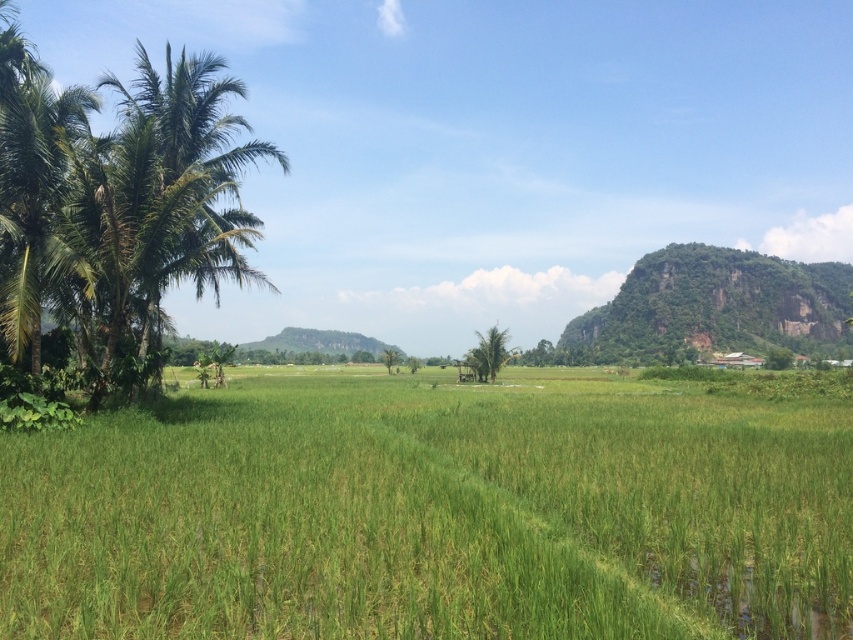
Question: Can you confirm if green grassy rice field at center is bigger than green leafy coconut tree at left?

Choices:
 (A) no
 (B) yes

Answer: (A)

Question: Which point appears closest to the camera in this image?

Choices:
 (A) (94, 634)
 (B) (622, 326)

Answer: (A)

Question: Observing the image, what is the correct spatial positioning of green rocky mountain at right in reference to green leafy palm tree at center?

Choices:
 (A) above
 (B) below

Answer: (A)

Question: Which point appears closest to the camera in this image?

Choices:
 (A) (x=476, y=376)
 (B) (x=605, y=634)
 (C) (x=3, y=141)
 (D) (x=757, y=340)

Answer: (B)

Question: In this image, where is green leafy coconut tree at left located relative to green leafy palm tree at center?

Choices:
 (A) above
 (B) below

Answer: (A)

Question: Which point is closer to the camera?

Choices:
 (A) green leafy palm tree at center
 (B) green grassy rice field at center

Answer: (B)